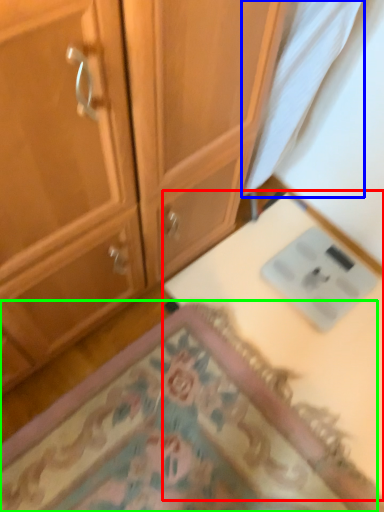
Question: Considering the real-world distances, which object is closest to table (highlighted by a red box)? fabric (highlighted by a blue box) or mat (highlighted by a green box).

Choices:
 (A) fabric
 (B) mat

Answer: (B)